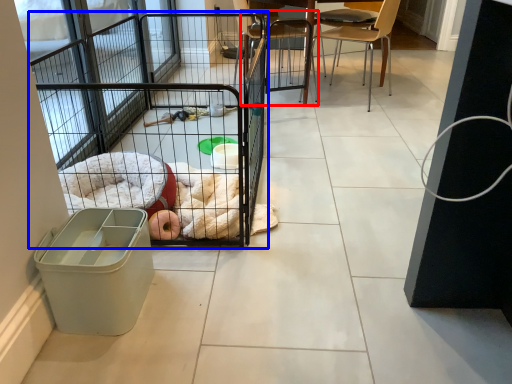
Question: Which point is closer to the camera, chair (highlighted by a red box) or cage (highlighted by a blue box)?

Choices:
 (A) chair
 (B) cage

Answer: (B)